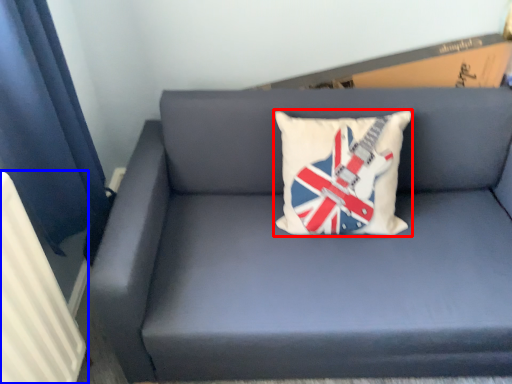
Question: Among these objects, which one is nearest to the camera, pillow (highlighted by a red box) or radiator (highlighted by a blue box)?

Choices:
 (A) pillow
 (B) radiator

Answer: (B)